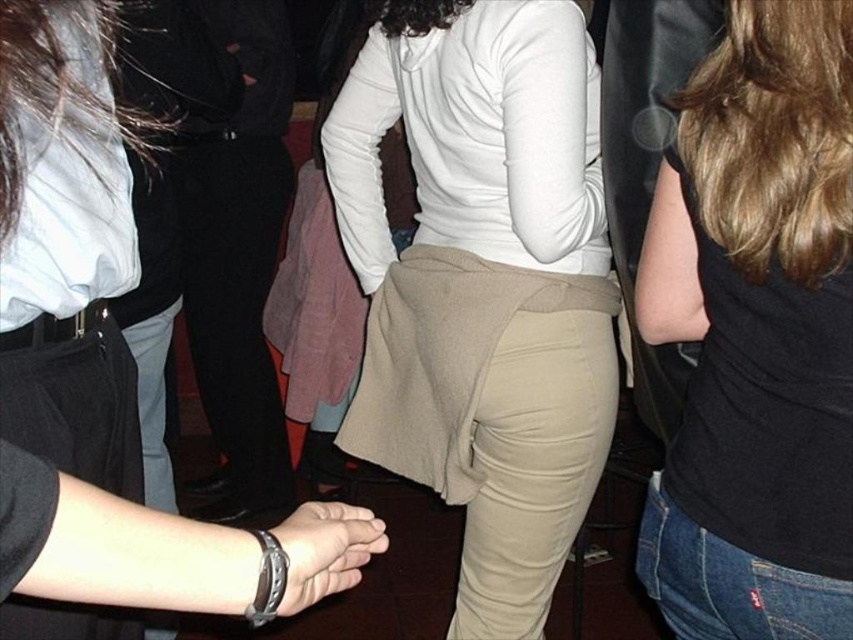
Who is shorter, khaki fabric pants at center or black matte tank top at upper right?

black matte tank top at upper right

Who is taller, khaki fabric pants at center or black matte tank top at upper right?

With more height is khaki fabric pants at center.

What do you see at coordinates (483, 284) in the screenshot? The width and height of the screenshot is (853, 640). I see `khaki fabric pants at center` at bounding box center [483, 284].

Where is `khaki fabric pants at center`? Image resolution: width=853 pixels, height=640 pixels. khaki fabric pants at center is located at coordinates (483, 284).

Is point (723, 112) positioned before point (318, 552)?

No.

Can you confirm if black matte tank top at upper right is taller than leather wristwatch at center?

Correct, black matte tank top at upper right is much taller as leather wristwatch at center.

Identify the location of black matte tank top at upper right. The width and height of the screenshot is (853, 640). (757, 332).

Between khaki fabric pants at center and leather wristwatch at center, which one has more height?

khaki fabric pants at center

Which is below, khaki fabric pants at center or leather wristwatch at center?

leather wristwatch at center is lower down.

Is point (415, 339) in front of point (294, 589)?

No, it is not.

Image resolution: width=853 pixels, height=640 pixels. Find the location of `khaki fabric pants at center`. khaki fabric pants at center is located at coordinates click(x=483, y=284).